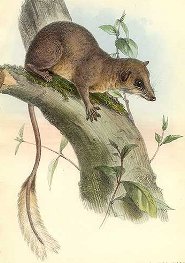
In order to click on painting in this screenshot , I will do `click(82, 88)`.